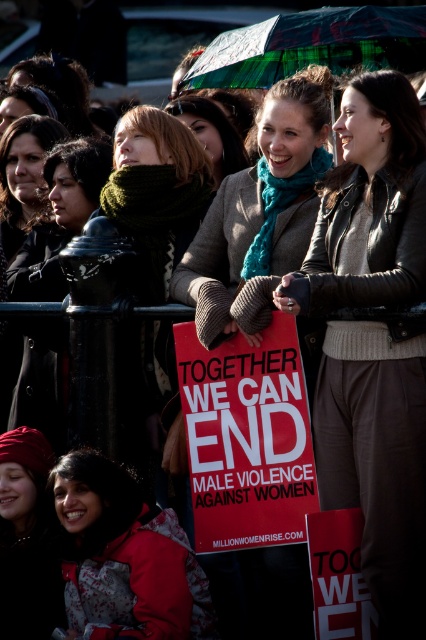
You are a photographer standing at the red matte placard at center and want to take a photo of the green plaid umbrella at upper center. If your camera has a maximum focus range of 20 meters, will you be able to capture the umbrella clearly?

The distance between the red matte placard at center and the green plaid umbrella at upper center is 20.68 meters, which exceeds the camera maximum focus range of 20 meters. Therefore, the photographer cannot capture the umbrella clearly.

What is the spatial relationship between the red jacket at lower left and the red knit hat at lower left in the scene?

The red jacket at lower left is positioned under the red knit hat at lower left.